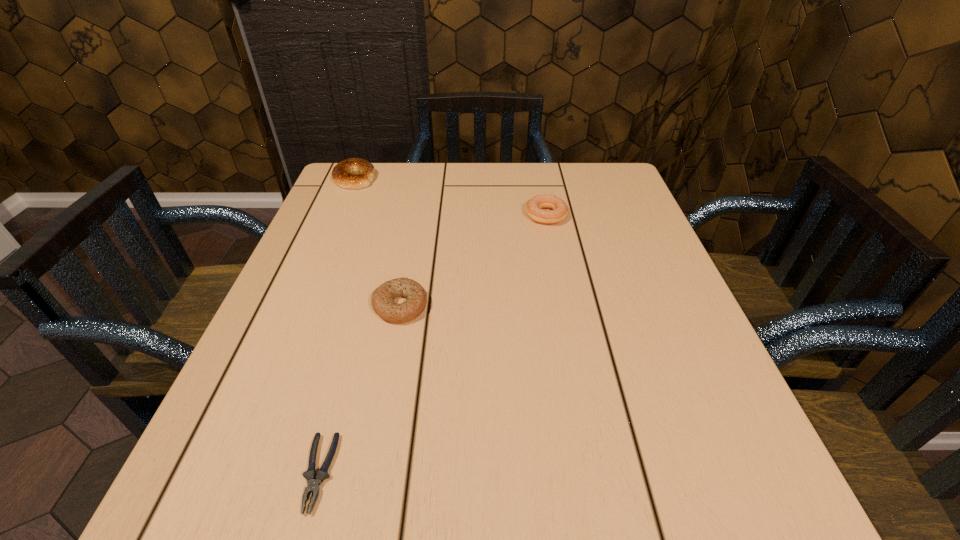
In the image, there is a desktop. Where is `vacant space at the near left corner`? vacant space at the near left corner is located at coordinates (202, 498).

You are a GUI agent. You are given a task and a screenshot of the screen. Output one action in this format:
    pyautogui.click(x=<x>, y=<y>)
    Task: Click on the vacant space at the far right corner
    
    Given the screenshot: What is the action you would take?
    pyautogui.click(x=631, y=198)

The width and height of the screenshot is (960, 540). In order to click on free space at the near right corner of the desktop in this screenshot , I will do `click(745, 476)`.

I want to click on free space between the farthest bagel and the second bagel from right to left, so click(x=377, y=241).

The image size is (960, 540). Identify the location of vacant area that lies between the shortest object and the second bagel from right to left. (359, 389).

The image size is (960, 540). Find the location of `free spot between the second nearest bagel and the second bagel from left to right`. free spot between the second nearest bagel and the second bagel from left to right is located at coordinates tap(473, 260).

You are a GUI agent. You are given a task and a screenshot of the screen. Output one action in this format:
    pyautogui.click(x=<x>, y=<y>)
    Task: Click on the free spot between the nearest bagel and the leftmost object
    Image resolution: width=960 pixels, height=540 pixels.
    Given the screenshot: What is the action you would take?
    pyautogui.click(x=377, y=241)

The width and height of the screenshot is (960, 540). I want to click on vacant space that is in between the rightmost bagel and the farthest bagel, so click(x=450, y=197).

You are a GUI agent. You are given a task and a screenshot of the screen. Output one action in this format:
    pyautogui.click(x=<x>, y=<y>)
    Task: Click on the free space between the shortest object and the leftmost bagel
    
    Given the screenshot: What is the action you would take?
    pyautogui.click(x=337, y=326)

At what (x,y) coordinates should I click in order to perform the action: click on vacant region between the farthest bagel and the second nearest object. Please return your answer as a coordinate pair (x, y). The image size is (960, 540). Looking at the image, I should click on (377, 241).